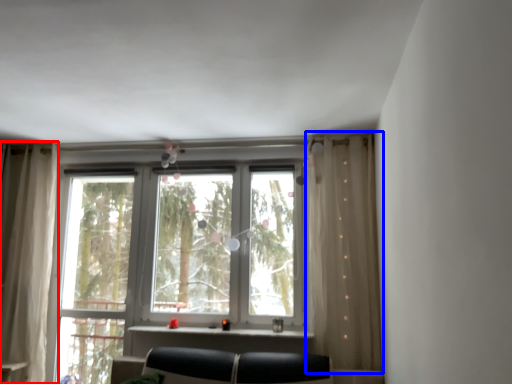
Question: Which object appears closest to the camera in this image, curtain (highlighted by a red box) or curtain (highlighted by a blue box)?

Choices:
 (A) curtain
 (B) curtain

Answer: (B)